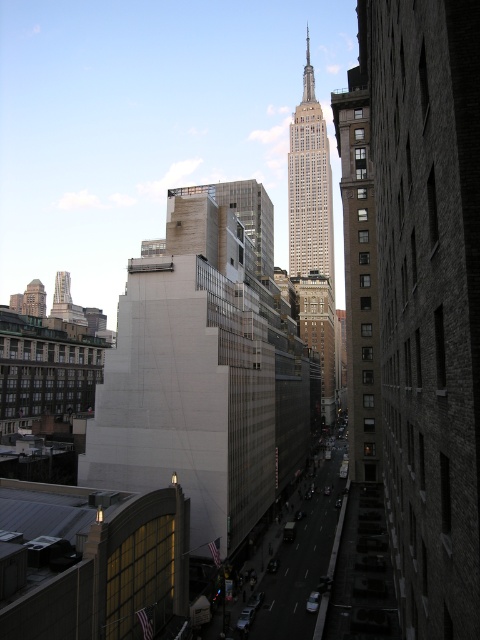
Does white concrete building at center have a lesser height compared to gray stone tower at center?

Indeed, white concrete building at center has a lesser height compared to gray stone tower at center.

Does white concrete building at center appear under gray stone tower at center?

Yes, white concrete building at center is below gray stone tower at center.

The image size is (480, 640). Describe the element at coordinates (202, 376) in the screenshot. I see `white concrete building at center` at that location.

This screenshot has width=480, height=640. I want to click on white concrete building at center, so click(202, 376).

The width and height of the screenshot is (480, 640). What do you see at coordinates (202, 376) in the screenshot?
I see `white concrete building at center` at bounding box center [202, 376].

Which is more to the left, white concrete building at center or brown brick building at right?

Positioned to the left is white concrete building at center.

This screenshot has height=640, width=480. What do you see at coordinates (202, 376) in the screenshot?
I see `white concrete building at center` at bounding box center [202, 376].

At what (x,y) coordinates should I click in order to perform the action: click on white concrete building at center. Please return your answer as a coordinate pair (x, y). Image resolution: width=480 pixels, height=640 pixels. Looking at the image, I should click on (202, 376).

Locate an element on the screen. brown brick building at right is located at coordinates (360, 273).

This screenshot has height=640, width=480. What are the coordinates of `brown brick building at right` in the screenshot? It's located at (360, 273).